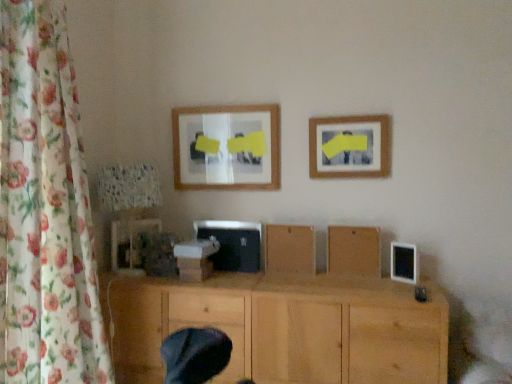
Identify the location of vacant space situated on the left part of wooden board at center, the 2th wood in the top-to-bottom sequence. This screenshot has height=384, width=512. (327, 272).